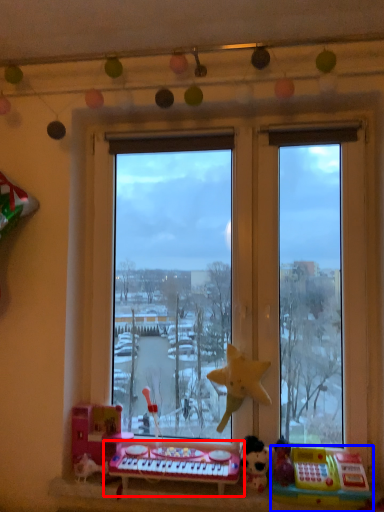
Question: Which of the following is the farthest to the observer, musical keyboard (highlighted by a red box) or toy (highlighted by a blue box)?

Choices:
 (A) musical keyboard
 (B) toy

Answer: (A)